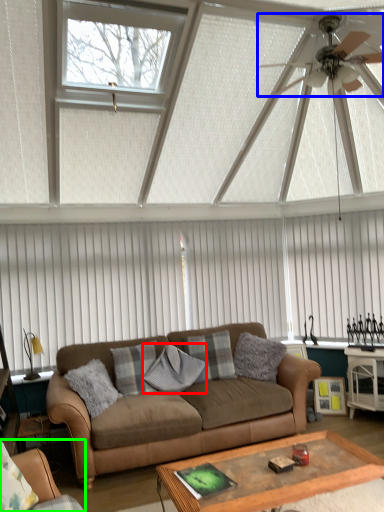
Question: Estimate the real-world distances between objects in this image. Which object is closer to pillow (highlighted by a red box), ceiling fan (highlighted by a blue box) or studio couch (highlighted by a green box)?

Choices:
 (A) ceiling fan
 (B) studio couch

Answer: (B)